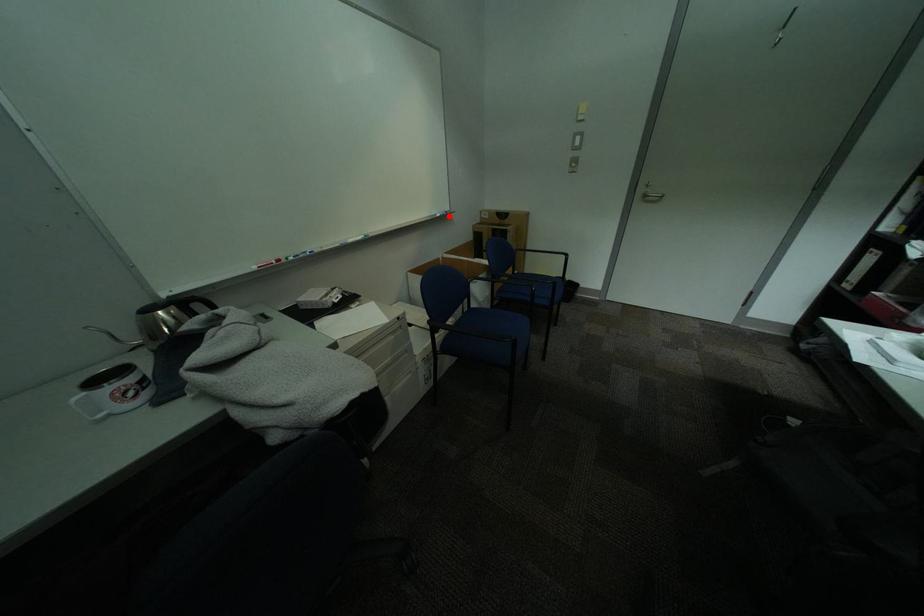
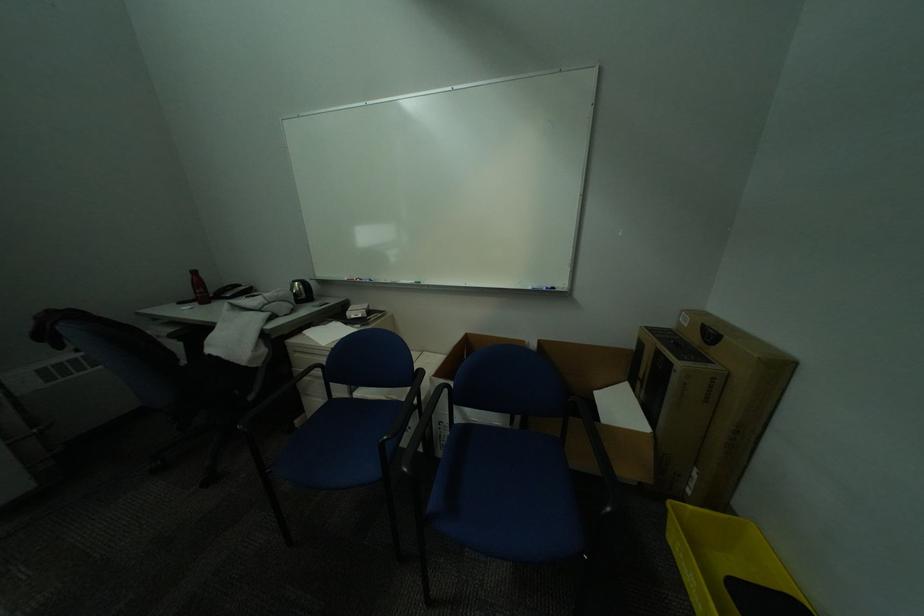
Where in the second image is the point corresponding to the highlighted location from the first image?

(541, 289)